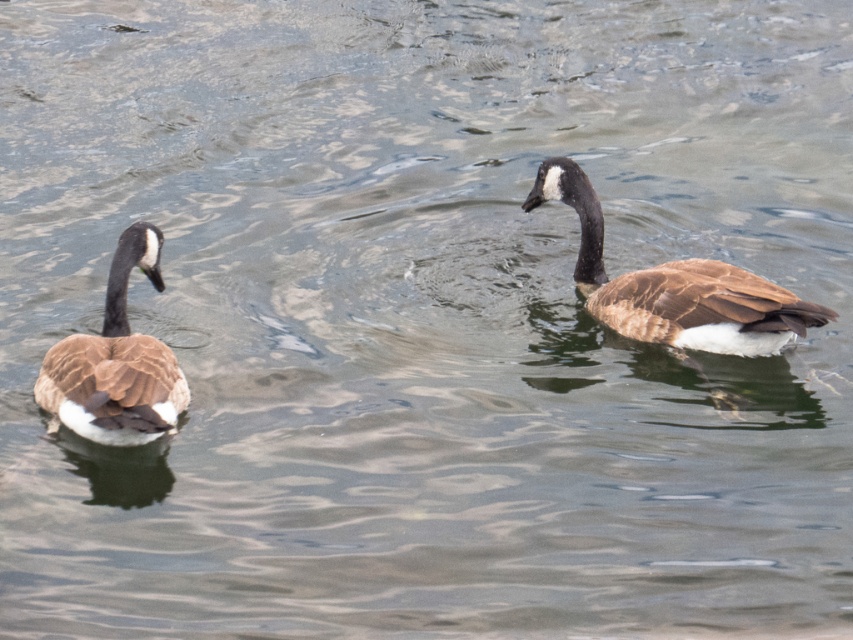
You are a wildlife photographer trying to capture both brown matte duck at right and brown matte duck at left in a single frame. Based on their sizes, which duck should you focus on first to ensure both fit in the frame?

The brown matte duck at right might be wider than brown matte duck at left, so focusing on the wider duck first would help ensure both fit in the frame.

You are standing on a dock and see the point marked at coordinates point [589,257]. The dock is 25 feet long. Can you reach that point by walking the entire length of the dock?

The distance of point [589,257] from viewer is 22.18 feet. Since the dock is 25 feet long, you can reach the point by walking the entire length of the dock as it is within the dock length.